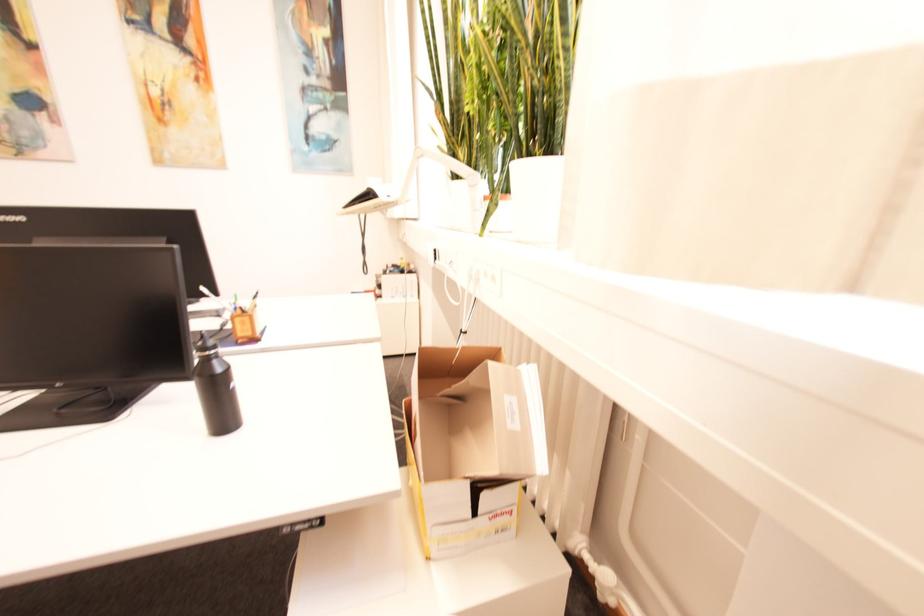
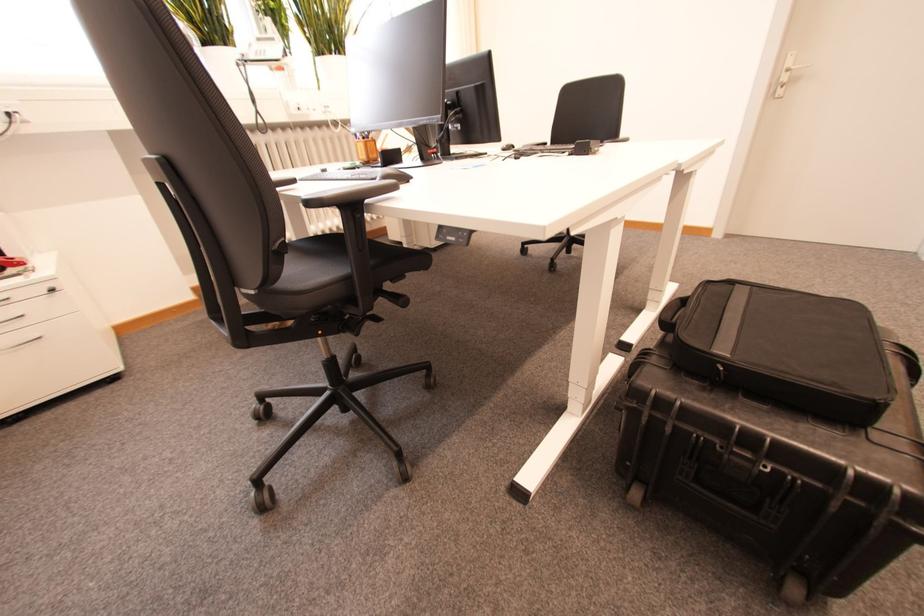
Question: I am providing you with two images of the same scene from different viewpoints. Please identify which objects are invisible in image2.

Choices:
 (A) computer mouse
 (B) white drawer handle
 (C) grill lid handle
 (D) desk lamp head

Answer: (D)